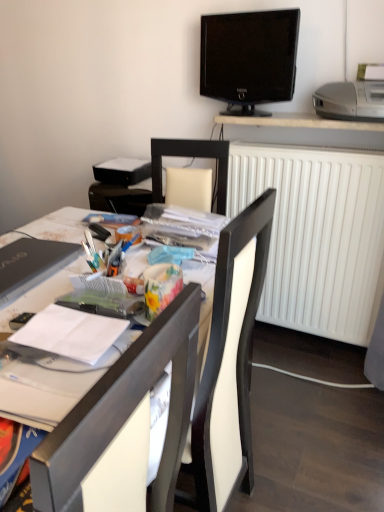
What do you see at coordinates (123, 418) in the screenshot? The height and width of the screenshot is (512, 384). I see `white glossy computer desk at center` at bounding box center [123, 418].

This screenshot has height=512, width=384. I want to click on black glossy tv at upper center, so click(249, 58).

From the image's perspective, is white glossy desk at upper center positioned above or below matte black laptop at left?

From the image's perspective, white glossy desk at upper center appears above matte black laptop at left.

Consider the image. Does white glossy desk at upper center appear on the left side of matte black laptop at left?

Incorrect, white glossy desk at upper center is not on the left side of matte black laptop at left.

Is white glossy desk at upper center inside the boundaries of matte black laptop at left, or outside?

white glossy desk at upper center is not enclosed by matte black laptop at left.

Would you say white glossy desk at upper center is a long distance from matte black laptop at left?

Indeed, white glossy desk at upper center is not near matte black laptop at left.

Is matte black laptop at left to the left of white glossy desk at upper center from the viewer's perspective?

Yes.

At what (x,y) coordinates should I click in order to perform the action: click on laptop below the white glossy desk at upper center (from a real-world perspective). Please return your answer as a coordinate pair (x, y). Looking at the image, I should click on (31, 265).

Looking at this image, in the image, is matte black laptop at left positioned in front of or behind white glossy desk at upper center?

Clearly, matte black laptop at left is in front of white glossy desk at upper center.

Considering the sizes of objects matte black laptop at left and white glossy desk at upper center in the image provided, who is thinner, matte black laptop at left or white glossy desk at upper center?

white glossy desk at upper center is thinner.

Between white matte radiator at right and white paper at center, which one appears on the right side from the viewer's perspective?

white matte radiator at right is more to the right.

The width and height of the screenshot is (384, 512). I want to click on radiator above the white paper at center (from the image's perspective), so click(317, 234).

From the image's perspective, is white matte radiator at right beneath white paper at center?

No, from the image's perspective, white matte radiator at right is not beneath white paper at center.

Is white matte radiator at right looking in the opposite direction of white paper at center?

white matte radiator at right is not turned away from white paper at center.

Which object is further away from the camera, silver metallic printer at upper right or white matte radiator at right?

white matte radiator at right is behind.

From the image's perspective, between silver metallic printer at upper right and white matte radiator at right, who is located below?

From the image's view, white matte radiator at right is below.

Is silver metallic printer at upper right directly adjacent to white matte radiator at right?

No, silver metallic printer at upper right is not with white matte radiator at right.

Which of these two, silver metallic printer at upper right or white matte radiator at right, is smaller?

With smaller size is silver metallic printer at upper right.

Where is `laptop on the left of white glossy computer desk at center`? laptop on the left of white glossy computer desk at center is located at coordinates (31, 265).

Based on the photo, can you tell me how much white glossy computer desk at center and matte black laptop at left differ in facing direction?

There is a 4.81-degree angle between the facing directions of white glossy computer desk at center and matte black laptop at left.

From a real-world perspective, is white glossy computer desk at center under matte black laptop at left?

Yes, from a real-world perspective, white glossy computer desk at center is beneath matte black laptop at left.

Which is nearer, (159, 353) or (30, 275)?

Point (159, 353).

From the image's perspective, is silver metallic printer at upper right beneath matte black laptop at left?

Actually, silver metallic printer at upper right appears above matte black laptop at left in the image.

Between silver metallic printer at upper right and matte black laptop at left, which one has smaller width?

With smaller width is matte black laptop at left.

How different are the orientations of silver metallic printer at upper right and matte black laptop at left in degrees?

There is a 87.3-degree angle between the facing directions of silver metallic printer at upper right and matte black laptop at left.

You are a GUI agent. You are given a task and a screenshot of the screen. Output one action in this format:
    pyautogui.click(x=<x>, y=<y>)
    Task: Click on the printer behind the matte black laptop at left
    This screenshot has height=512, width=384.
    Given the screenshot: What is the action you would take?
    pyautogui.click(x=350, y=101)

Is white glossy desk at upper center wider or thinner than white plastic chair at center?

white glossy desk at upper center is thinner than white plastic chair at center.

Does white glossy desk at upper center appear on the left side of white plastic chair at center?

No, white glossy desk at upper center is not to the left of white plastic chair at center.

Where is `desk on the right of white plastic chair at center`? The height and width of the screenshot is (512, 384). desk on the right of white plastic chair at center is located at coordinates (305, 131).

Relative to white plastic chair at center, is white glossy desk at upper center in front or behind?

In the image, white glossy desk at upper center appears behind white plastic chair at center.

The image size is (384, 512). In order to click on desk above the matte black laptop at left (from the image's perspective) in this screenshot , I will do `click(305, 131)`.

Locate an element on the screen. This screenshot has height=512, width=384. laptop below the white glossy desk at upper center (from a real-world perspective) is located at coordinates (31, 265).

Estimate the real-world distances between objects in this image. Which object is closer to white paper at center, black glossy tv at upper center or white matte radiator at right?

white matte radiator at right.

Considering their positions, is black glossy tv at upper center positioned closer to white plastic chair at center than white paper at center?

white paper at center is positioned closer to the anchor white plastic chair at center.

When comparing their distances from white plastic chair at center, does white matte radiator at right or white glossy desk at upper center seem closer?

Among the two, white matte radiator at right is located nearer to white plastic chair at center.

Considering their positions, is white matte radiator at right positioned further to white plastic chair at center than white paper at center?

white matte radiator at right is further to white plastic chair at center.

Considering their positions, is matte black laptop at left positioned closer to black glossy tv at upper center than white matte radiator at right?

white matte radiator at right is positioned closer to the anchor black glossy tv at upper center.

Considering their positions, is white matte radiator at right positioned closer to silver metallic printer at upper right than white plastic chair at center?

The object closer to silver metallic printer at upper right is white matte radiator at right.

Based on their spatial positions, is white paper at center or white matte radiator at right further from white glossy desk at upper center?

Based on the image, white paper at center appears to be further to white glossy desk at upper center.

When comparing their distances from matte black laptop at left, does black glossy tv at upper center or silver metallic printer at upper right seem further?

silver metallic printer at upper right lies further to matte black laptop at left than the other object.

Image resolution: width=384 pixels, height=512 pixels. Identify the location of desk between black glossy tv at upper center and silver metallic printer at upper right in the horizontal direction. (305, 131).

The width and height of the screenshot is (384, 512). Identify the location of magazine situated between matte black laptop at left and silver metallic printer at upper right from left to right. (69, 334).

At what (x,y) coordinates should I click in order to perform the action: click on radiator between black glossy tv at upper center and white glossy computer desk at center in the vertical direction. Please return your answer as a coordinate pair (x, y). Looking at the image, I should click on (317, 234).

At what (x,y) coordinates should I click in order to perform the action: click on laptop between black glossy tv at upper center and white paper at center vertically. Please return your answer as a coordinate pair (x, y). Looking at the image, I should click on (31, 265).